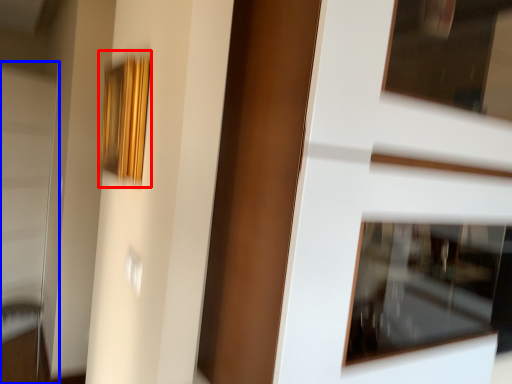
Question: Among these objects, which one is nearest to the camera, picture frame (highlighted by a red box) or screen door (highlighted by a blue box)?

Choices:
 (A) picture frame
 (B) screen door

Answer: (A)